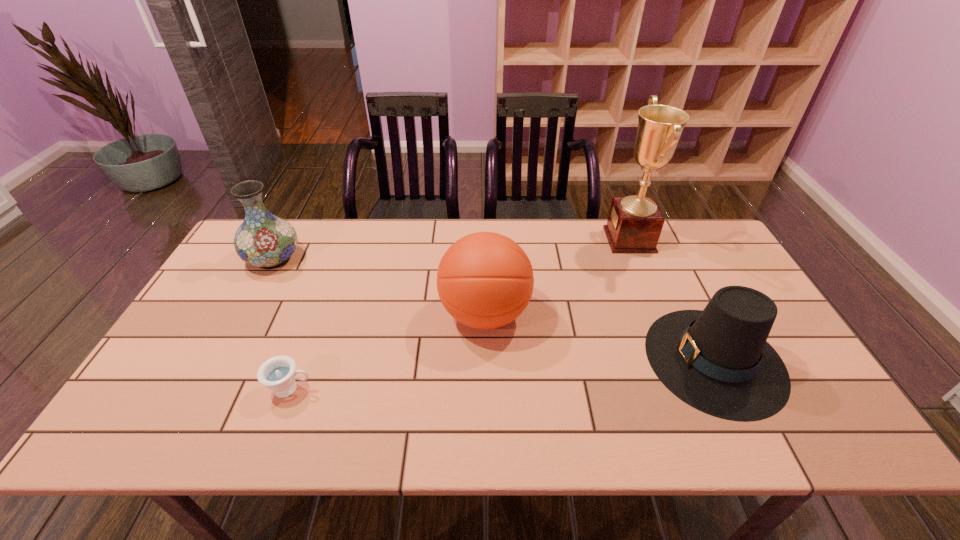
Locate an element on the screen. This screenshot has width=960, height=540. blank space located 0.210m on the front of the third object from left to right is located at coordinates click(486, 424).

Identify the location of blank space located 0.270m on the front-facing side of the fourth tallest object. The height and width of the screenshot is (540, 960). (540, 359).

Find the location of a particular element. Image resolution: width=960 pixels, height=540 pixels. blank area located on the front-facing side of the fourth tallest object is located at coordinates (497, 359).

The width and height of the screenshot is (960, 540). I want to click on vacant space situated on the front-facing side of the fourth tallest object, so click(608, 359).

Identify the location of free space located on the side of the shortest object with the handle. (474, 389).

Locate an element on the screen. Image resolution: width=960 pixels, height=540 pixels. trophy cup at the far edge is located at coordinates (634, 225).

Locate an element on the screen. vase that is at the far edge is located at coordinates (267, 241).

The image size is (960, 540). Identify the location of object located in the near edge section of the desktop. (718, 361).

This screenshot has width=960, height=540. I want to click on object that is at the left edge, so click(267, 241).

In order to click on object located at the right edge in this screenshot , I will do `click(718, 361)`.